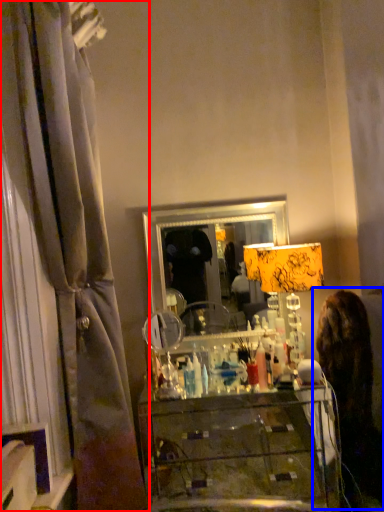
Question: Which of the following is the farthest to the observer, curtain (highlighted by a red box) or woman (highlighted by a blue box)?

Choices:
 (A) curtain
 (B) woman

Answer: (B)